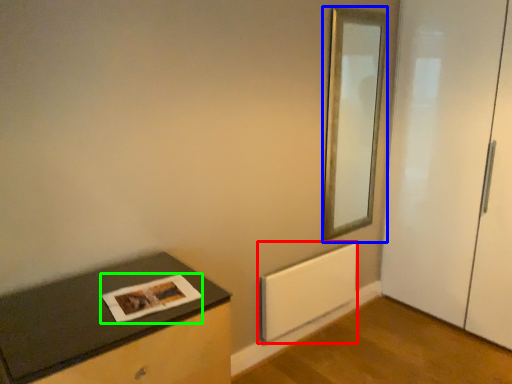
Question: Estimate the real-world distances between objects in this image. Which object is closer to radiator (highlighted by a red box), mirror (highlighted by a blue box) or magazine (highlighted by a green box)?

Choices:
 (A) mirror
 (B) magazine

Answer: (A)